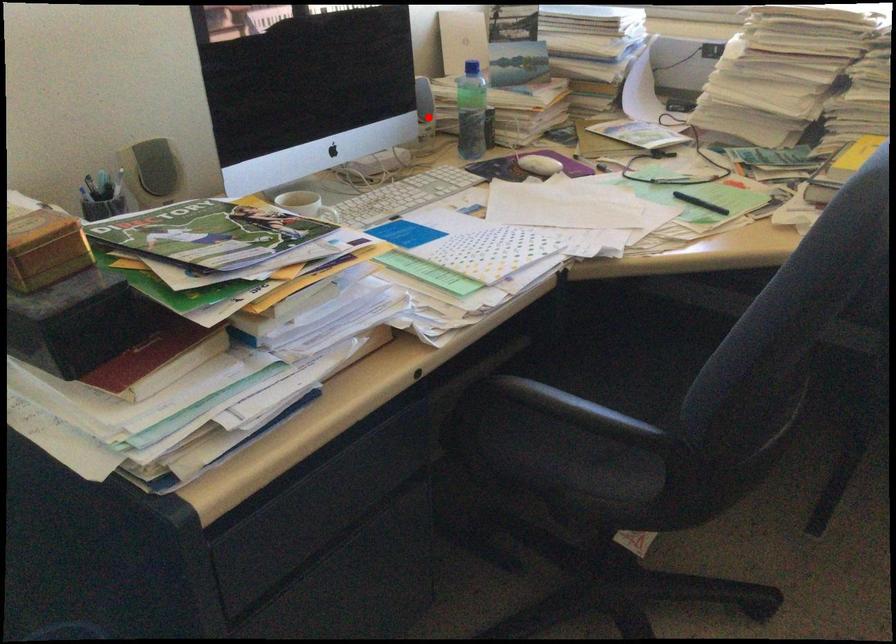
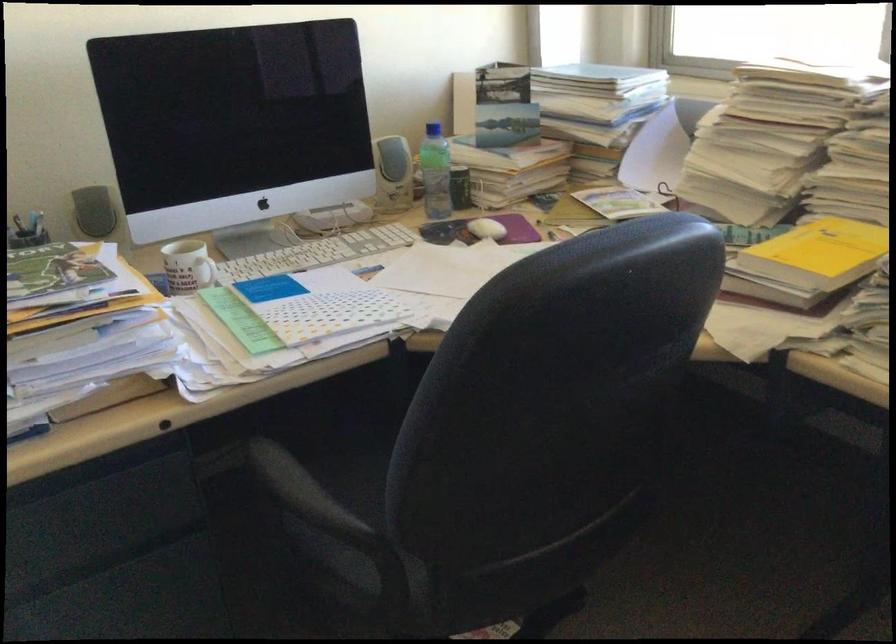
Locate, in the second image, the point that corresponds to the highlighted location in the first image.

(392, 174)